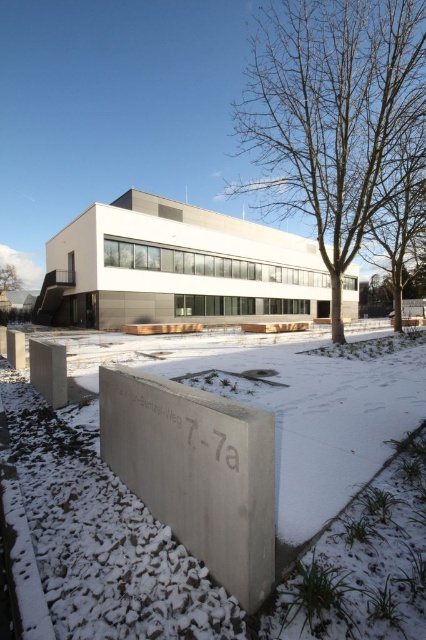
Can you confirm if bare wood tree at center is bigger than brown wood tree at upper left?

Yes.

Who is more forward, (x=330, y=166) or (x=8, y=282)?

Point (x=330, y=166)

Image resolution: width=426 pixels, height=640 pixels. Identify the location of bare wood tree at center. (331, 115).